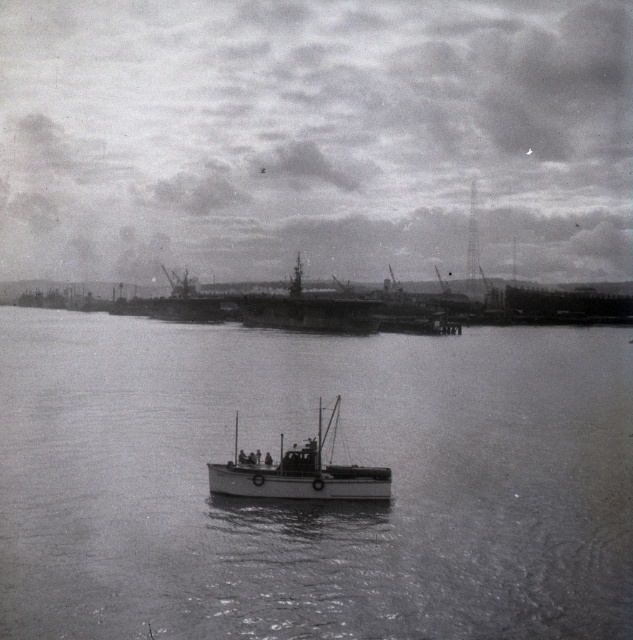
Question: In this image, where is smooth water at center located relative to smooth white boat at center?

Choices:
 (A) left
 (B) right

Answer: (A)

Question: Which point is farther to the camera?

Choices:
 (A) smooth metal ship at center
 (B) smooth white boat at center

Answer: (A)

Question: Is smooth water at center positioned in front of smooth metal ship at center?

Choices:
 (A) yes
 (B) no

Answer: (A)

Question: Is smooth white boat at center smaller than smooth metal ship at center?

Choices:
 (A) no
 (B) yes

Answer: (B)

Question: Estimate the real-world distances between objects in this image. Which object is farther from the smooth metal ship at center?

Choices:
 (A) smooth white boat at center
 (B) smooth water at center

Answer: (A)

Question: Among these objects, which one is farthest from the camera?

Choices:
 (A) smooth water at center
 (B) smooth metal ship at center

Answer: (B)